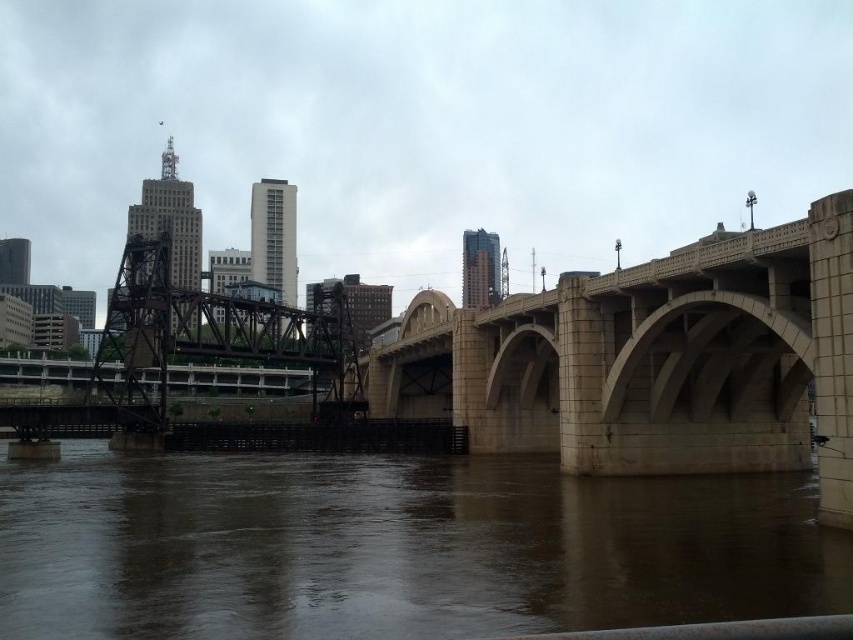
You are a city planner reviewing the city layout. You need to determine the spatial relationship between the matte concrete bridge at center and the brown concrete river at lower center. Based on the scene, which object is positioned further away from the viewer?

The brown concrete river at lower center is positioned behind the matte concrete bridge at center, meaning it is further away from the viewer.

You are a delivery drone that needs to fly from the matte concrete bridge at center to the brown concrete river at lower center. Can you safely descend vertically from the bridge to land on the river?

The matte concrete bridge at center is located above the brown concrete river at lower center, so yes, the drone can safely descend vertically from the matte concrete bridge at center to land on the brown concrete river at lower center.

You are a city planner analyzing the image. You need to determine which structure is wider for planning purposes. Which is wider, the matte concrete bridge at center or the brown concrete river at lower center?

The matte concrete bridge at center is wider than the brown concrete river at lower center according to the description.